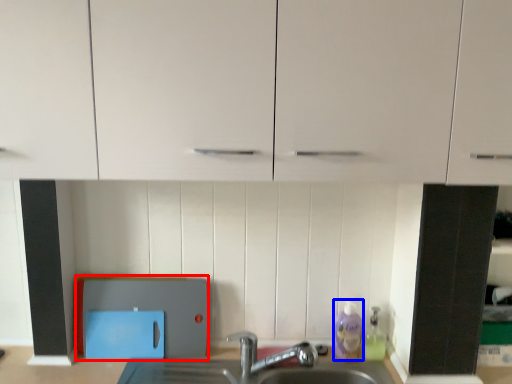
Question: Which of the following is the closest to the observer, appliance (highlighted by a red box) or cleaning product (highlighted by a blue box)?

Choices:
 (A) appliance
 (B) cleaning product

Answer: (A)